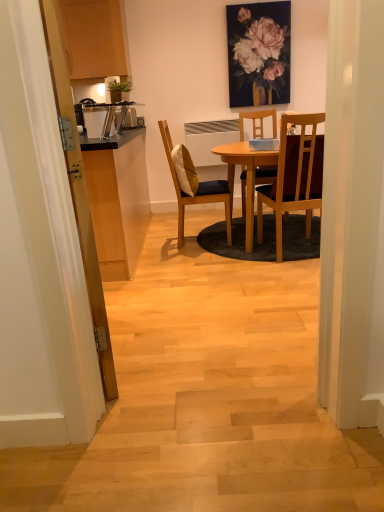
Question: Considering the relative positions of transparent wooden door at left and yellow fabric pillow at center in the image provided, is transparent wooden door at left behind yellow fabric pillow at center?

Choices:
 (A) no
 (B) yes

Answer: (A)

Question: Is transparent wooden door at left taller than yellow fabric pillow at center?

Choices:
 (A) no
 (B) yes

Answer: (B)

Question: Can you confirm if transparent wooden door at left is shorter than yellow fabric pillow at center?

Choices:
 (A) no
 (B) yes

Answer: (A)

Question: Considering the relative sizes of transparent wooden door at left and yellow fabric pillow at center in the image provided, is transparent wooden door at left smaller than yellow fabric pillow at center?

Choices:
 (A) yes
 (B) no

Answer: (B)

Question: Is transparent wooden door at left facing towards yellow fabric pillow at center?

Choices:
 (A) yes
 (B) no

Answer: (B)

Question: From the image's perspective, relative to matte floral painting at upper center, is yellow fabric pillow at center above or below?

Choices:
 (A) below
 (B) above

Answer: (A)

Question: Would you say yellow fabric pillow at center is inside or outside matte floral painting at upper center?

Choices:
 (A) outside
 (B) inside

Answer: (A)

Question: In terms of size, does yellow fabric pillow at center appear bigger or smaller than matte floral painting at upper center?

Choices:
 (A) big
 (B) small

Answer: (A)

Question: Based on their positions, is yellow fabric pillow at center located to the left or right of matte floral painting at upper center?

Choices:
 (A) left
 (B) right

Answer: (A)

Question: From the image's perspective, relative to matte floral painting at upper center, is transparent wooden door at left above or below?

Choices:
 (A) below
 (B) above

Answer: (A)

Question: Is transparent wooden door at left bigger or smaller than matte floral painting at upper center?

Choices:
 (A) big
 (B) small

Answer: (A)

Question: Considering the positions of transparent wooden door at left and matte floral painting at upper center in the image, is transparent wooden door at left taller or shorter than matte floral painting at upper center?

Choices:
 (A) short
 (B) tall

Answer: (B)

Question: Based on their positions, is transparent wooden door at left located to the left or right of matte floral painting at upper center?

Choices:
 (A) right
 (B) left

Answer: (B)

Question: Considering the positions of point (261, 196) and point (92, 273), is point (261, 196) closer or farther from the camera than point (92, 273)?

Choices:
 (A) farther
 (B) closer

Answer: (A)

Question: From a real-world perspective, is wooden chair at center, the second chair from the left, above or below transparent wooden door at left?

Choices:
 (A) above
 (B) below

Answer: (B)